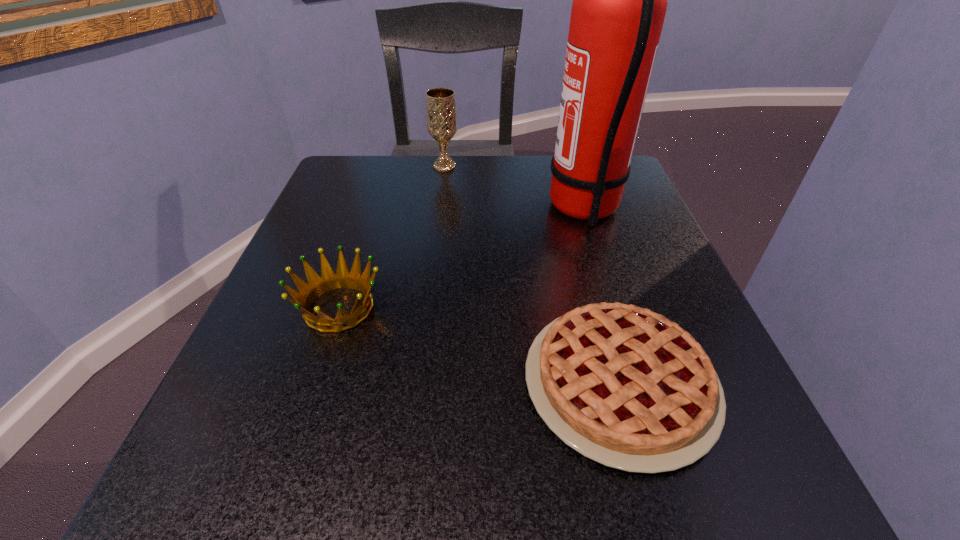
Where is `fire extinguisher`? This screenshot has height=540, width=960. fire extinguisher is located at coordinates (619, 5).

The image size is (960, 540). I want to click on the second farthest object, so click(x=619, y=5).

I want to click on the farthest object, so click(x=440, y=102).

Where is `the third object from right to left`? The image size is (960, 540). the third object from right to left is located at coordinates (440, 102).

This screenshot has height=540, width=960. Identify the location of the third tallest object. (329, 280).

Identify the location of crown. The height and width of the screenshot is (540, 960). (329, 280).

The height and width of the screenshot is (540, 960). I want to click on the shortest object, so [626, 387].

At what (x,y) coordinates should I click in order to perform the action: click on free space located 0.120m on the handle side of the tallest object. Please return your answer as a coordinate pair (x, y). Looking at the image, I should click on (490, 209).

You are a GUI agent. You are given a task and a screenshot of the screen. Output one action in this format:
    pyautogui.click(x=<x>, y=<y>)
    Task: Click on the free region located 0.230m on the handle side of the tallest object
    The image size is (960, 540).
    Given the screenshot: What is the action you would take?
    pyautogui.click(x=437, y=209)

Where is `free space located 0.260m on the handle side of the tallest object`? This screenshot has height=540, width=960. free space located 0.260m on the handle side of the tallest object is located at coordinates click(422, 209).